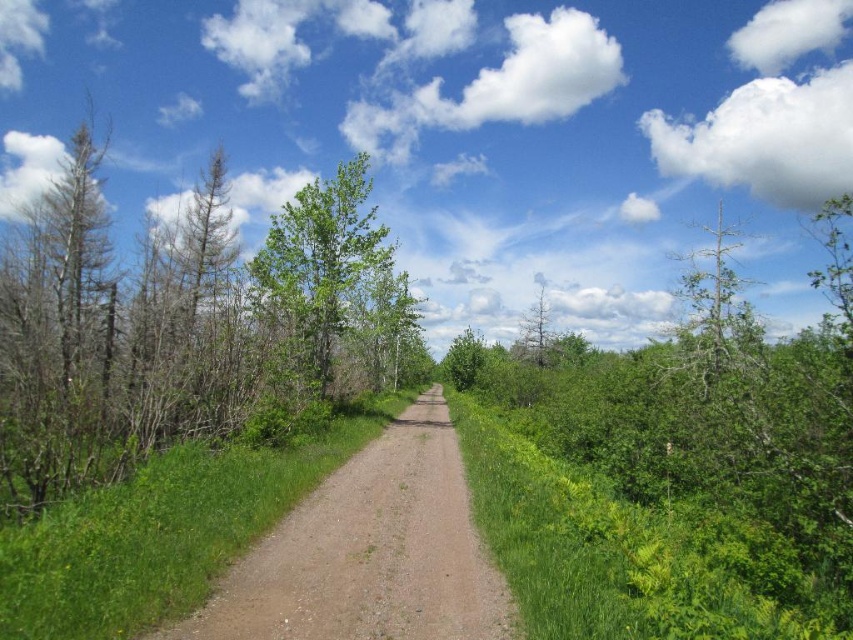
Question: Is dirt/gravel path at center in front of green leafy tree at center?

Choices:
 (A) no
 (B) yes

Answer: (B)

Question: Is dirt/gravel path at center bigger than green leafy tree at center?

Choices:
 (A) no
 (B) yes

Answer: (A)

Question: Which is farther from the green leafy tree at left?

Choices:
 (A) green leafy tree at center
 (B) dirt/gravel path at center

Answer: (B)

Question: Which of the following is the farthest from the observer?

Choices:
 (A) (329, 326)
 (B) (396, 273)

Answer: (B)

Question: Which point appears closest to the camera in this image?

Choices:
 (A) (399, 538)
 (B) (405, 340)

Answer: (A)

Question: Is the position of green leafy tree at left less distant than that of dirt/gravel path at center?

Choices:
 (A) yes
 (B) no

Answer: (B)